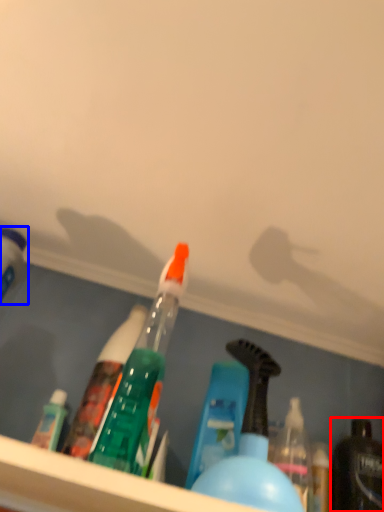
Question: Among these objects, which one is farthest to the camera, bottle (highlighted by a red box) or bottle (highlighted by a blue box)?

Choices:
 (A) bottle
 (B) bottle

Answer: (A)